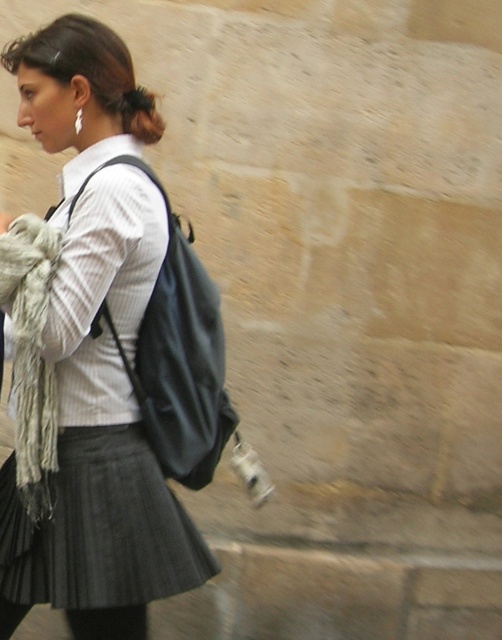
You are a photographer trying to capture the person walking past the stone wall. Which object, the matte black backpack at center or the dark brown hair at upper center, will appear larger in your photo due to its position?

The matte black backpack at center will appear larger in the photo because it is closer to the viewer than the dark brown hair at upper center.

Based on the scene description, can the width of the matte black backpack at center potentially cover the dark brown hair at upper center if positioned directly in front of it?

The matte black backpack at center might be wider than dark brown hair at upper center, so it could potentially cover the hair if positioned directly in front.